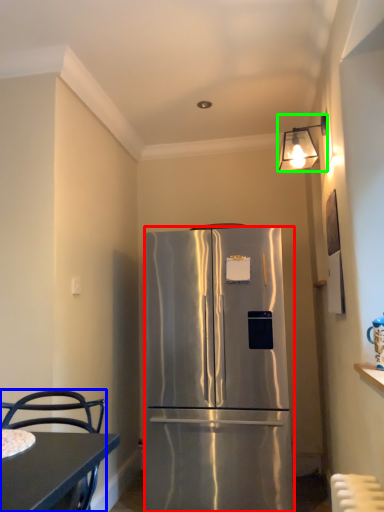
Question: Estimate the real-world distances between objects in this image. Which object is farther from refrigerator (highlighted by a red box), chair (highlighted by a blue box) or lamp (highlighted by a green box)?

Choices:
 (A) chair
 (B) lamp

Answer: (B)